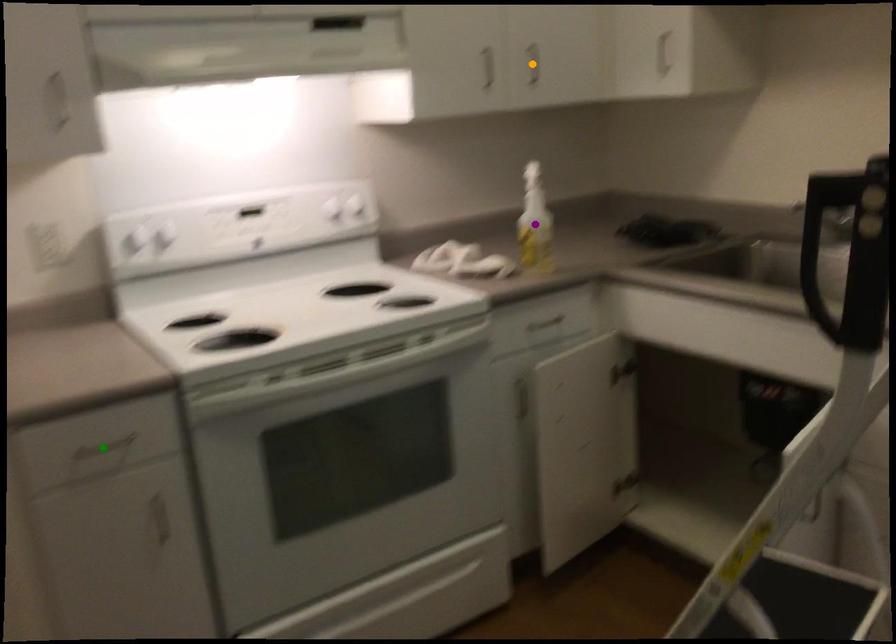
Order these from nearest to farthest:
1. orange point
2. purple point
3. green point

green point, purple point, orange point